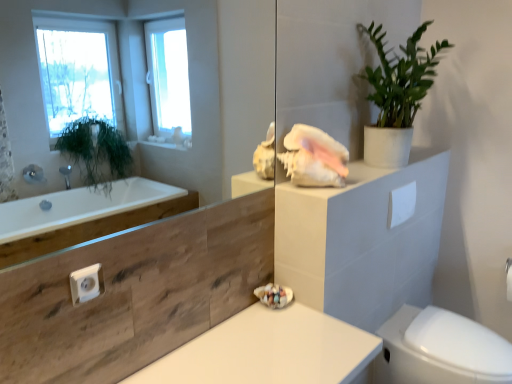
Describe the element at coordinates (268, 350) in the screenshot. The image size is (512, 384). I see `white matte countertop at center` at that location.

What is the approximate height of white glossy bidet at lower right?

The height of white glossy bidet at lower right is 17.30 inches.

From the picture: What is the approximate height of transparent glass mirror at upper center?

It is 24.95 inches.

Identify the location of white matte toilet paper at upper right. (401, 204).

What do you see at coordinates (401, 204) in the screenshot? Image resolution: width=512 pixels, height=384 pixels. I see `white matte toilet paper at upper right` at bounding box center [401, 204].

You are a GUI agent. You are given a task and a screenshot of the screen. Output one action in this format:
    pyautogui.click(x=<x>, y=<y>)
    Task: Click on the white matte countertop at center
    
    Given the screenshot: What is the action you would take?
    pyautogui.click(x=268, y=350)

From the image's perspective, is transparent glass mirror at upper center below white matte countertop at center?

No, from the image's perspective, transparent glass mirror at upper center is not below white matte countertop at center.

Does point (167, 332) lie in front of point (249, 356)?

That is True.

Between transparent glass mirror at upper center and white matte countertop at center, which one has larger width?

white matte countertop at center is wider.

Which is nearer, (270, 323) or (401, 217)?

Point (270, 323).

Does white matte countertop at center have a greater width compared to white matte toilet paper at upper right?

Yes.

You are a GUI agent. You are given a task and a screenshot of the screen. Output one action in this format:
    pyautogui.click(x=<x>, y=<y>)
    Task: Click on the toilet paper on the right of white matte countertop at center
    The height and width of the screenshot is (384, 512).
    Given the screenshot: What is the action you would take?
    pyautogui.click(x=401, y=204)

From the image's perspective, is white matte countertop at center above or below white matte toilet paper at upper right?

white matte countertop at center is situated lower than white matte toilet paper at upper right in the image.

Do you think transparent glass mirror at upper center is within white matte toilet paper at upper right, or outside of it?

transparent glass mirror at upper center cannot be found inside white matte toilet paper at upper right.

Considering the positions of objects transparent glass mirror at upper center and white matte toilet paper at upper right in the image provided, who is more to the right, transparent glass mirror at upper center or white matte toilet paper at upper right?

white matte toilet paper at upper right is more to the right.

Could you tell me if transparent glass mirror at upper center is turned towards white matte toilet paper at upper right?

No, transparent glass mirror at upper center is not facing towards white matte toilet paper at upper right.

Does green matte plant at upper right have a smaller size compared to transparent glass mirror at upper center?

Actually, green matte plant at upper right might be larger than transparent glass mirror at upper center.

Is green matte plant at upper right not near transparent glass mirror at upper center?

Yes.

Looking at this image, how many degrees apart are the facing directions of green matte plant at upper right and transparent glass mirror at upper center?

The angular difference between green matte plant at upper right and transparent glass mirror at upper center is 0.641 degrees.

Locate an element on the screen. The image size is (512, 384). mirror in front of the green matte plant at upper right is located at coordinates (134, 294).

Which object is wider, green matte plant at upper right or white matte countertop at center?

white matte countertop at center is wider.

Does green matte plant at upper right appear on the right side of white matte countertop at center?

Yes.

In the scene shown: Is green matte plant at upper right positioned before white matte countertop at center?

No, green matte plant at upper right is further to the viewer.

Which of these two, green matte plant at upper right or white matte countertop at center, stands shorter?

white matte countertop at center is shorter.

Could you tell me if white matte toilet paper at upper right is turned towards white glossy bidet at lower right?

No, white matte toilet paper at upper right does not turn towards white glossy bidet at lower right.

Does white matte toilet paper at upper right touch white glossy bidet at lower right?

No.

Does white matte toilet paper at upper right come in front of white glossy bidet at lower right?

No, the depth of white matte toilet paper at upper right is greater than that of white glossy bidet at lower right.

From the picture: Measure the distance between white matte toilet paper at upper right and white glossy bidet at lower right.

A: They are 56.90 centimeters apart.

Consider the image. How much distance is there between white matte toilet paper at upper right and transparent glass mirror at upper center?

A distance of 5.67 feet exists between white matte toilet paper at upper right and transparent glass mirror at upper center.

Is white matte toilet paper at upper right placed right next to transparent glass mirror at upper center?

No, white matte toilet paper at upper right is not with transparent glass mirror at upper center.

Can you confirm if white matte toilet paper at upper right is wider than transparent glass mirror at upper center?

Correct, the width of white matte toilet paper at upper right exceeds that of transparent glass mirror at upper center.

Is white matte toilet paper at upper right positioned beyond the bounds of transparent glass mirror at upper center?

white matte toilet paper at upper right lies outside transparent glass mirror at upper center's area.

Where is `mirror lying on the left of white matte countertop at center`? mirror lying on the left of white matte countertop at center is located at coordinates (134, 294).

In order to click on toilet paper behind the white matte countertop at center in this screenshot , I will do tap(401, 204).

Based on their spatial positions, is white matte toilet paper at upper right or white glossy bidet at lower right further from transparent glass mirror at upper center?

white glossy bidet at lower right is further to transparent glass mirror at upper center.

Which object lies nearer to the anchor point green matte plant at upper right, white matte countertop at center or transparent glass mirror at upper center?

white matte countertop at center.

When comparing their distances from white glossy bidet at lower right, does white matte countertop at center or green matte plant at upper right seem further?

Among the two, green matte plant at upper right is located further to white glossy bidet at lower right.

From the image, which object appears to be farther from white glossy bidet at lower right, white matte toilet paper at upper right or white matte countertop at center?

white matte countertop at center.

Looking at this image, when comparing their distances from green matte plant at upper right, does white glossy bidet at lower right or white matte toilet paper at upper right seem further?

white glossy bidet at lower right is positioned further to the anchor green matte plant at upper right.

From the image, which object appears to be farther from transparent glass mirror at upper center, white glossy bidet at lower right or white matte countertop at center?

white matte countertop at center is further to transparent glass mirror at upper center.

Considering their positions, is green matte plant at upper right positioned closer to transparent glass mirror at upper center than white glossy bidet at lower right?

Among the two, green matte plant at upper right is located nearer to transparent glass mirror at upper center.

From the image, which object appears to be nearer to white glossy bidet at lower right, green matte plant at upper right or transparent glass mirror at upper center?

green matte plant at upper right.

Image resolution: width=512 pixels, height=384 pixels. Find the location of `mirror between green matte plant at upper right and white glossy bidet at lower right in the vertical direction`. mirror between green matte plant at upper right and white glossy bidet at lower right in the vertical direction is located at coordinates coord(134,294).

The height and width of the screenshot is (384, 512). What are the coordinates of `mirror between green matte plant at upper right and white matte countertop at center vertically` in the screenshot? It's located at (134, 294).

Identify the location of counter top between transparent glass mirror at upper center and white glossy bidet at lower right. (268, 350).

At what (x,y) coordinates should I click in order to perform the action: click on houseplant between transparent glass mirror at upper center and white matte toilet paper at upper right in the front-back direction. Please return your answer as a coordinate pair (x, y). Looking at the image, I should click on (397, 95).